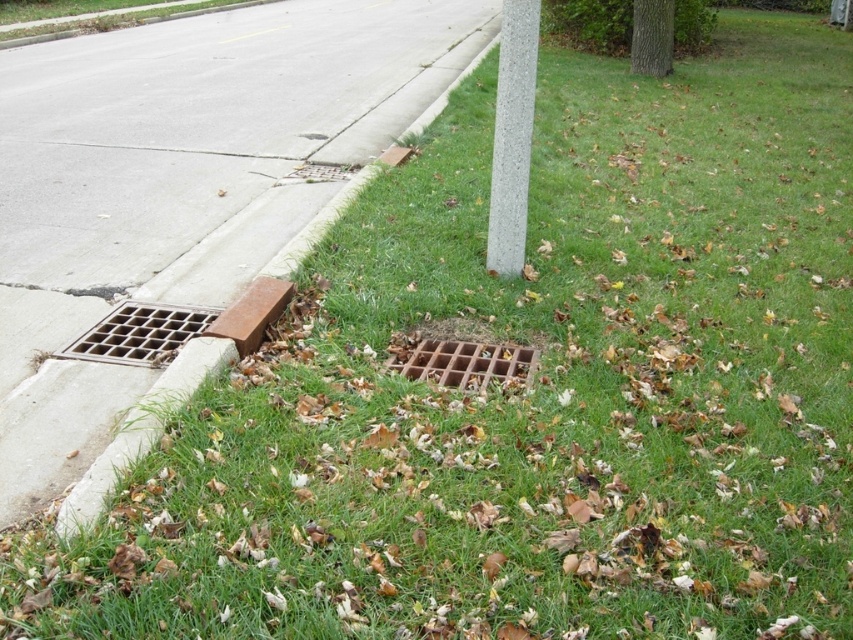
You are a delivery person trying to park your bike. The bike has a kickstand that needs to be placed on a surface wider than 30 cm. You see the brown metal grate at lower center and the gray concrete pole at upper center. Which surface can accommodate the kickstand?

The brown metal grate at lower center might be wider than 30 cm, so it could accommodate the kickstand. The gray concrete pole at upper center is narrower, so it might not be suitable.

You are a delivery person needing to place a small box on the ground near the road. You have two options for placement spots near the brown metal grate at lower center and the brown metal grate at lower left. Which spot has more space to place the box without it overlapping the grate?

The brown metal grate at lower center has a larger width than the brown metal grate at lower left, so the spot near the brown metal grate at lower center provides more space to place the box without overlapping the grate.

You are standing at the origin point of the image coordinate system. You want to walk to the brown metal grate at lower center. Which direction should you move? Please answer with coordinates in the format of x and y. The coordinate system is defined as follows. The origin is at the bottom left corner of the image. The x axis goes to the right, and the y axis goes upward.

The brown metal grate at lower center is located at point (181, 182). Since you are at the origin point, you should move to the right along the x axis to 0.287 and upward along the y axis to 0.213 to reach it.